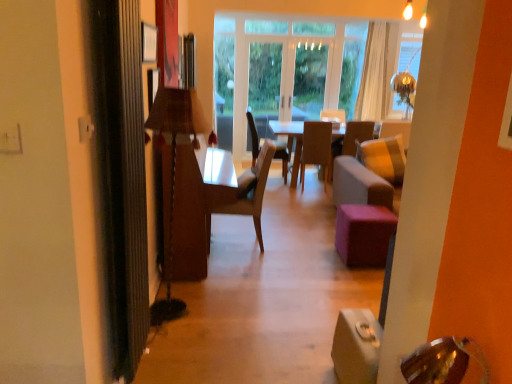
Where is `free space that is in between wooden lamp at left and purple fabric stool at center`? The image size is (512, 384). free space that is in between wooden lamp at left and purple fabric stool at center is located at coordinates (284, 273).